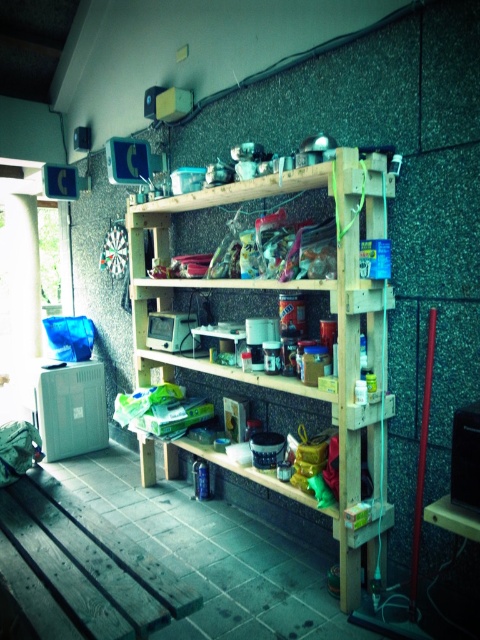
Question: Can you confirm if natural wood pantry at center is positioned above dark wood workbench at lower left?

Choices:
 (A) no
 (B) yes

Answer: (B)

Question: Does natural wood pantry at center have a greater width compared to dark wood workbench at lower left?

Choices:
 (A) no
 (B) yes

Answer: (B)

Question: Is natural wood pantry at center further to camera compared to dark wood workbench at lower left?

Choices:
 (A) no
 (B) yes

Answer: (B)

Question: Which point is closer to the camera?

Choices:
 (A) (141, 580)
 (B) (381, 476)

Answer: (A)

Question: Which object appears farthest from the camera in this image?

Choices:
 (A) natural wood pantry at center
 (B) dark wood workbench at lower left

Answer: (A)